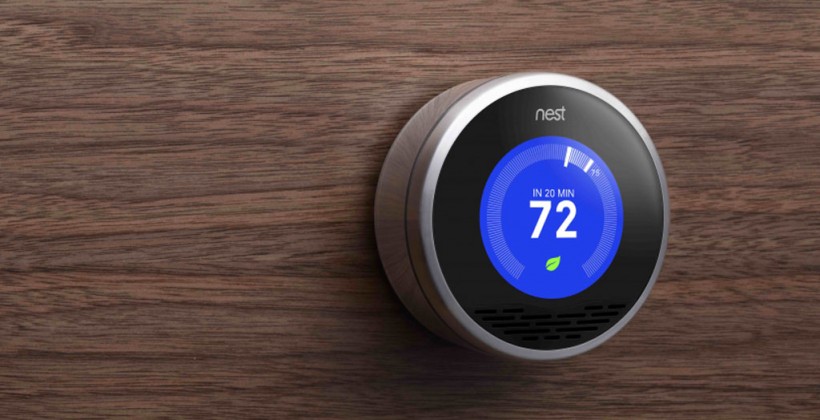
Identify the location of wall. (365, 176).